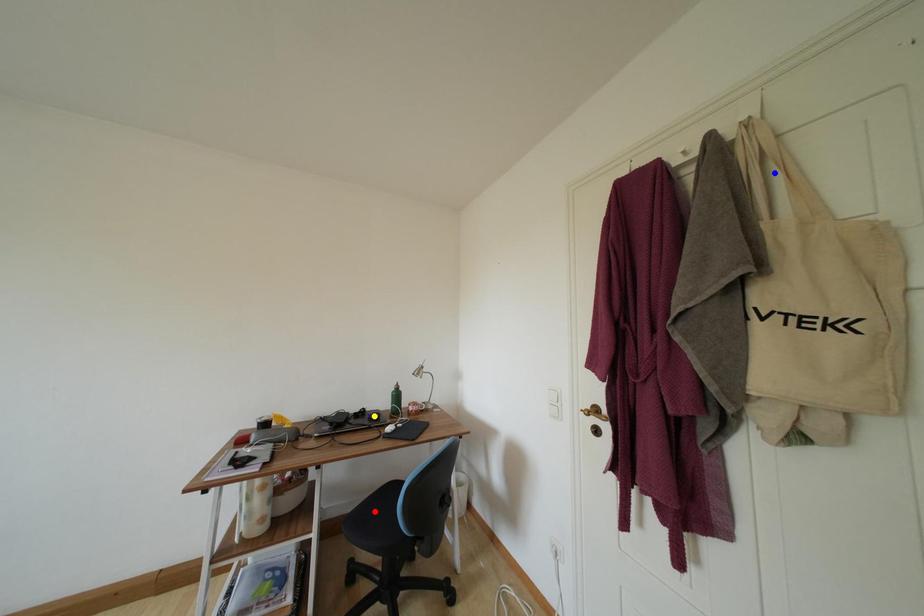
Order these from nearest to farthest:
- blue point
- yellow point
- red point

yellow point → red point → blue point